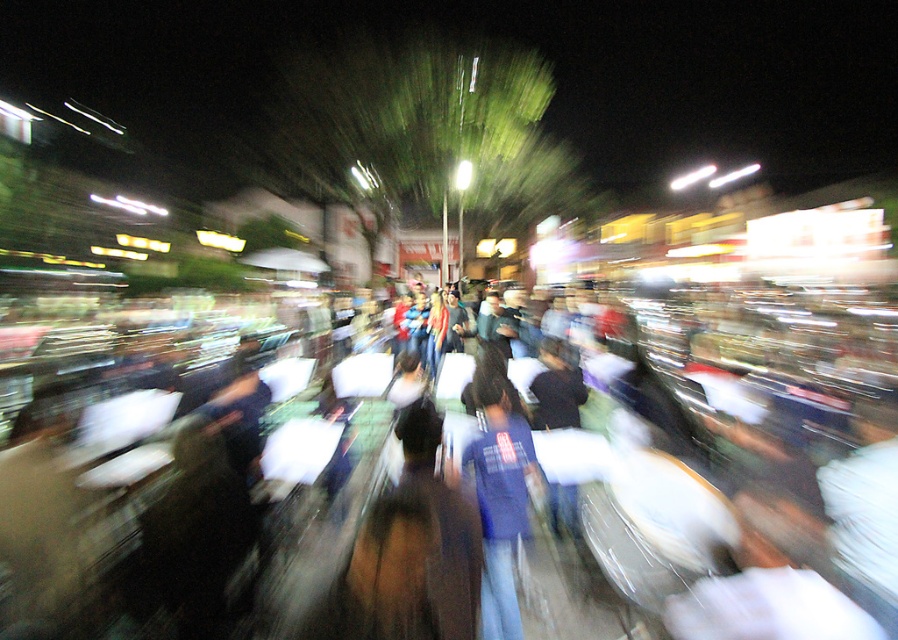
Is point (48, 486) closer to viewer compared to point (487, 628)?

No, it is behind (487, 628).

Between point (183, 524) and point (498, 529), which one is positioned behind?

The point (498, 529) is more distant.

Identify the location of white cotton pillows at center. This screenshot has height=640, width=898. (641, 513).